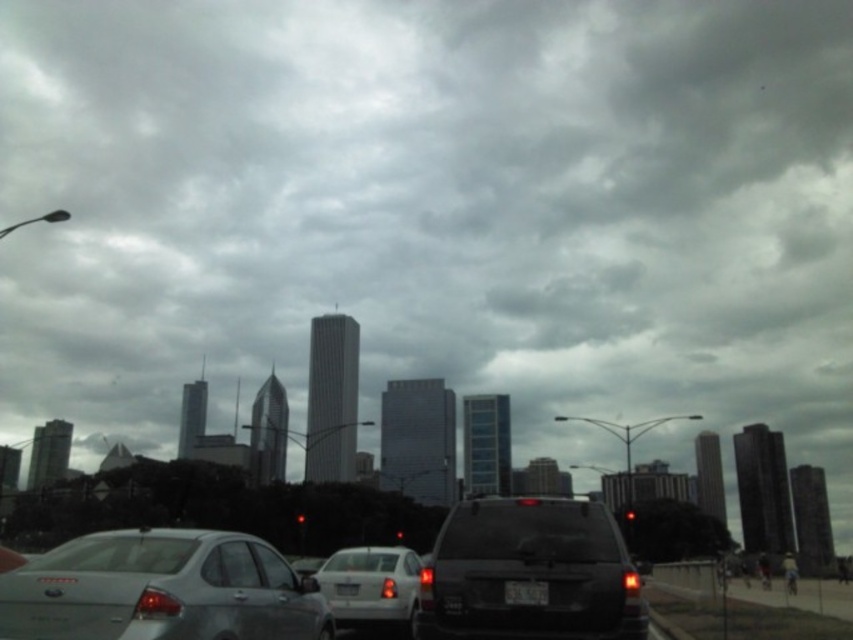
Question: Does black matte tree at center have a greater width compared to white plastic license plate at center?

Choices:
 (A) no
 (B) yes

Answer: (B)

Question: Which point is closer to the camera?

Choices:
 (A) (341, 589)
 (B) (543, 568)
 (C) (509, 588)

Answer: (B)

Question: Is satin silver sedan at lower left closer to camera compared to white plastic license plate at center?

Choices:
 (A) yes
 (B) no

Answer: (A)

Question: Among these points, which one is farthest from the camera?

Choices:
 (A) (339, 588)
 (B) (532, 600)
 (C) (498, 589)
 (D) (624, 513)

Answer: (D)

Question: Which object is the farthest from the white matte sedan at center?

Choices:
 (A) white plastic license plate at center
 (B) red glass traffic light at center

Answer: (B)

Question: Does satin silver sedan at lower left appear on the left side of white plastic license plate at center?

Choices:
 (A) yes
 (B) no

Answer: (A)